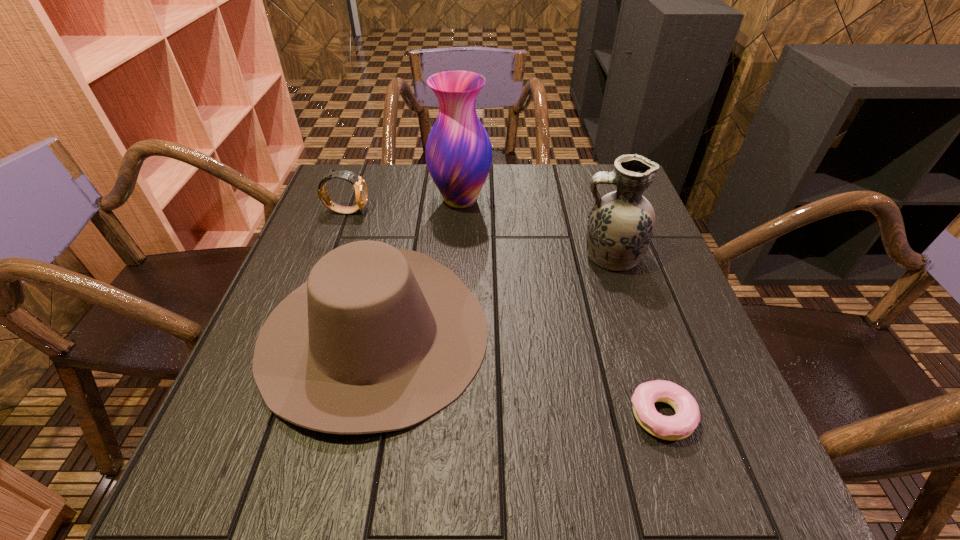
This screenshot has width=960, height=540. Find the location of `blank space located 0.240m with the handle on the side of the shorter vase`. blank space located 0.240m with the handle on the side of the shorter vase is located at coordinates (474, 256).

Where is `blank area located on the right of the cowboy hat`? The width and height of the screenshot is (960, 540). blank area located on the right of the cowboy hat is located at coordinates (639, 333).

The width and height of the screenshot is (960, 540). Identify the location of free region located 0.380m on the face of the watch. (513, 211).

Find the location of a particular element. The image size is (960, 540). vacant space located 0.140m on the left of the doughnut is located at coordinates (547, 415).

Locate an element on the screen. This screenshot has height=540, width=960. vase that is at the far edge is located at coordinates (458, 151).

Where is `watch that is at the far edge`? Image resolution: width=960 pixels, height=540 pixels. watch that is at the far edge is located at coordinates (361, 193).

At what (x,y) coordinates should I click in order to perform the action: click on cowboy hat that is at the left edge. Please return your answer as a coordinate pair (x, y). Looking at the image, I should click on tap(378, 339).

In order to click on watch that is at the left edge in this screenshot , I will do `click(361, 193)`.

Find the location of a particular element. This screenshot has width=960, height=540. vase situated at the right edge is located at coordinates (621, 224).

At what (x,y) coordinates should I click in order to perform the action: click on doughnut that is positioned at the right edge. Please return your answer as a coordinate pair (x, y). Image resolution: width=960 pixels, height=540 pixels. Looking at the image, I should click on (681, 425).